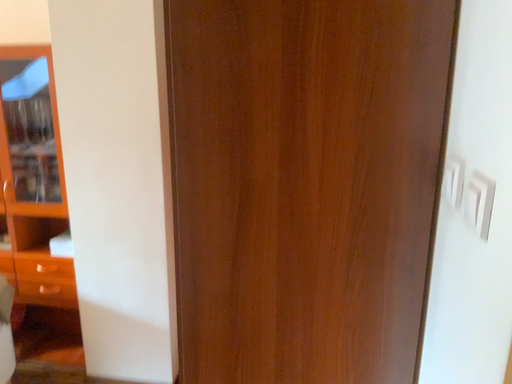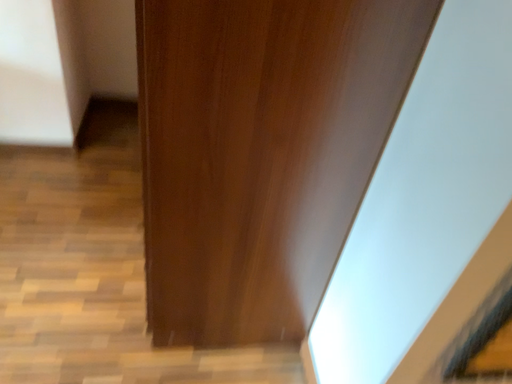
Question: Which way did the camera rotate in the video?

Choices:
 (A) rotated upward
 (B) rotated downward

Answer: (B)